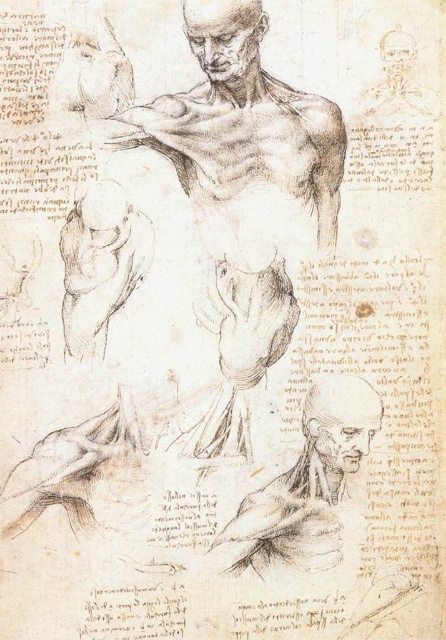
Which of these two, smooth gray head at upper center or grayish pencil sketch of head at lower right, stands shorter?

smooth gray head at upper center is shorter.

Can you confirm if smooth gray head at upper center is positioned to the right of grayish pencil sketch of head at lower right?

In fact, smooth gray head at upper center is to the left of grayish pencil sketch of head at lower right.

The height and width of the screenshot is (640, 446). Identify the location of smooth gray head at upper center. point(226,38).

Is point (314, 118) closer to viewer compared to point (379, 403)?

That is True.

Which is behind, point (250, 228) or point (273, 547)?

The point (250, 228) is more distant.

Find the location of a particular element. brown paper sketch of man at center is located at coordinates (243, 193).

Which is behind, point (264, 524) or point (342, 461)?

Point (342, 461)

Is smooth gray head at lower right thinner than grayish pencil sketch of head at lower right?

No.

Who is more distant from viewer, (271, 522) or (309, 416)?

The point (309, 416) is behind.

This screenshot has width=446, height=640. I want to click on smooth gray head at lower right, so click(x=309, y=481).